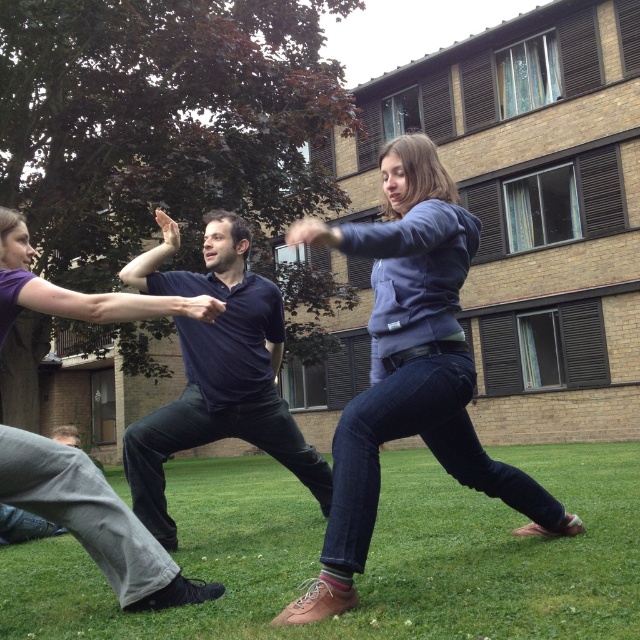
Question: Does dark blue shirt at center appear under matte purple shirt at center?

Choices:
 (A) no
 (B) yes

Answer: (A)

Question: Can you confirm if dark blue shirt at center is positioned below matte purple shirt at center?

Choices:
 (A) yes
 (B) no

Answer: (B)

Question: Which point appears closest to the camera in this image?

Choices:
 (A) (408, 512)
 (B) (292, 426)
 (C) (465, 392)

Answer: (C)

Question: Based on their relative distances, which object is nearer to the matte blue hoodie at center?

Choices:
 (A) matte purple shirt at center
 (B) green grass at lower center

Answer: (A)

Question: Among these points, which one is farthest from the camera?

Choices:
 (A) (448, 180)
 (B) (200, 406)
 (C) (74, 296)
 (D) (420, 625)

Answer: (B)

Question: Is the position of green grass at lower center more distant than that of matte purple shirt at center?

Choices:
 (A) yes
 (B) no

Answer: (B)